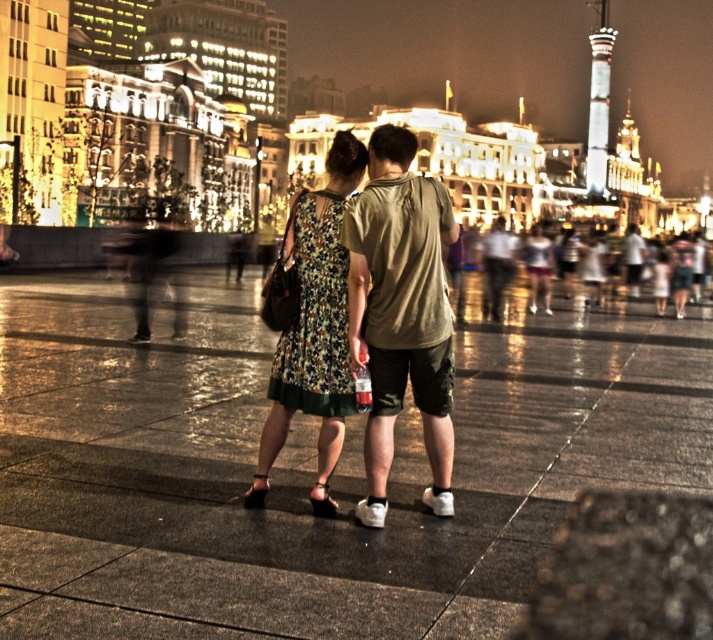
Question: Is matte khaki t-shirt at center to the left of floral fabric dress at center from the viewer's perspective?

Choices:
 (A) no
 (B) yes

Answer: (A)

Question: Which point is closer to the camera?

Choices:
 (A) floral fabric dress at center
 (B) matte khaki t-shirt at center

Answer: (B)

Question: Is matte khaki t-shirt at center positioned behind floral fabric dress at center?

Choices:
 (A) yes
 (B) no

Answer: (B)

Question: Is matte khaki t-shirt at center to the right of floral fabric dress at center from the viewer's perspective?

Choices:
 (A) no
 (B) yes

Answer: (B)

Question: Which object appears closest to the camera in this image?

Choices:
 (A) floral fabric dress at center
 (B) matte khaki t-shirt at center

Answer: (B)